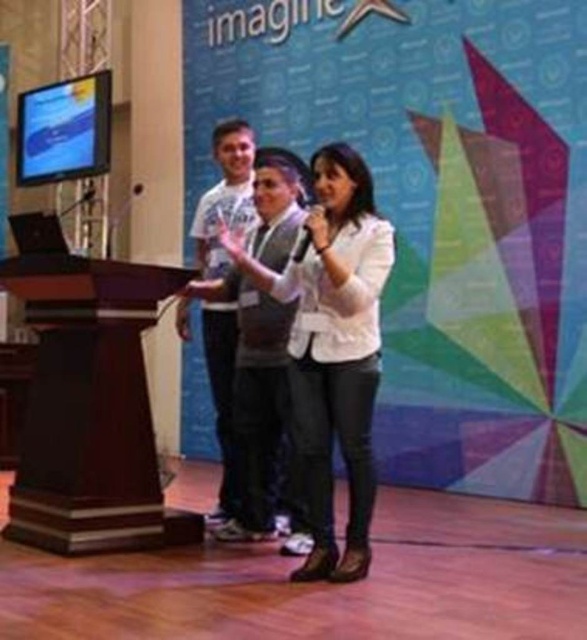
Is dark wood podium at left above white cotton t-shirt at center?

Incorrect, dark wood podium at left is not positioned above white cotton t-shirt at center.

I want to click on dark wood podium at left, so point(90,408).

Does white matte jacket at center appear on the left side of white cotton t-shirt at center?

In fact, white matte jacket at center is to the right of white cotton t-shirt at center.

Between white matte jacket at center and white cotton t-shirt at center, which one is positioned higher?

Positioned higher is white cotton t-shirt at center.

The width and height of the screenshot is (587, 640). In order to click on white matte jacket at center in this screenshot , I will do `click(335, 349)`.

Where is `white matte jacket at center`? This screenshot has height=640, width=587. white matte jacket at center is located at coordinates (335, 349).

You are a GUI agent. You are given a task and a screenshot of the screen. Output one action in this format:
    pyautogui.click(x=<x>, y=<y>)
    Task: Click on the white matte jacket at center
    The height and width of the screenshot is (640, 587).
    Given the screenshot: What is the action you would take?
    pyautogui.click(x=335, y=349)

Describe the element at coordinates (335, 349) in the screenshot. I see `white matte jacket at center` at that location.

You are a GUI agent. You are given a task and a screenshot of the screen. Output one action in this format:
    pyautogui.click(x=<x>, y=<y>)
    Task: Click on the white matte jacket at center
    Image resolution: width=587 pixels, height=640 pixels.
    Given the screenshot: What is the action you would take?
    pyautogui.click(x=335, y=349)